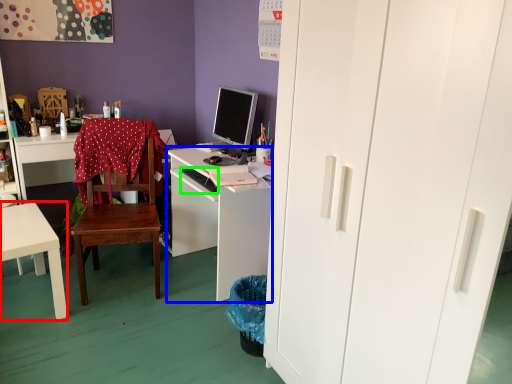
Question: Estimate the real-world distances between objects in this image. Which object is closer to desk (highlighted by a red box), desk (highlighted by a blue box) or computer keyboard (highlighted by a green box)?

Choices:
 (A) desk
 (B) computer keyboard

Answer: (A)